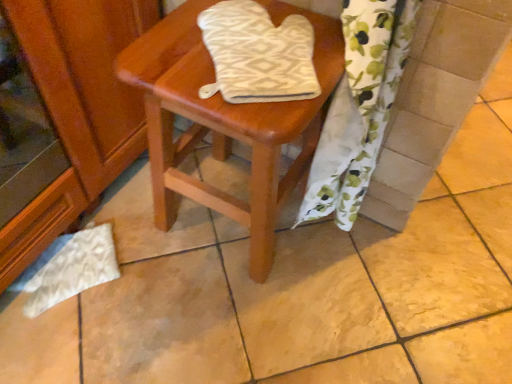
What are the coordinates of `free space in front of white floral fabric at lower right` in the screenshot? It's located at (314, 304).